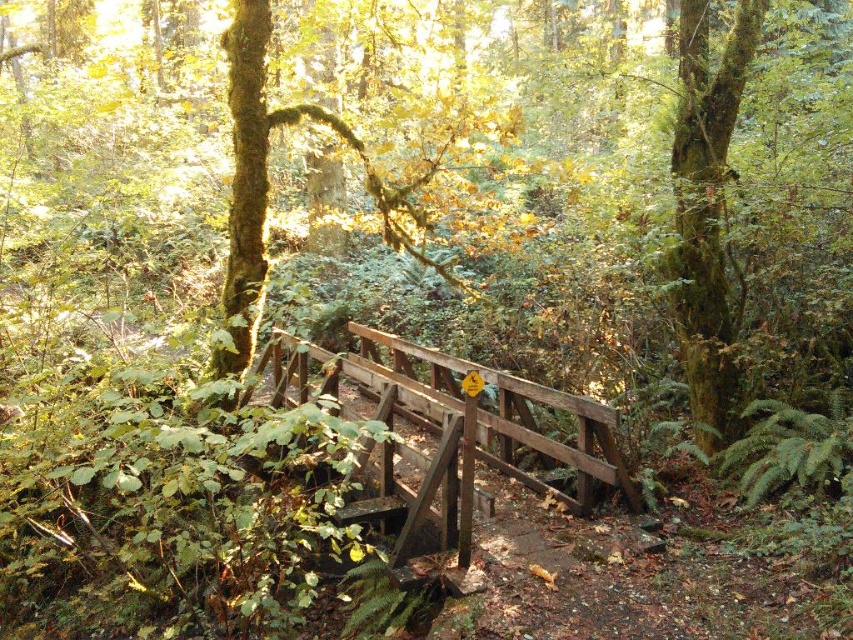
You are standing at the point with coordinates (450, 435) in the forest scene. Based on the image description, what structure are you most likely standing on?

The wooden bridge at center is represented by point (450, 435), so you are most likely standing on the wooden bridge at center.

You are a hiker who wants to cross the stream safely. The wooden bridge at center is your path. However, you notice a green mossy tree at upper left in the background. Is the bridge between you and the tree, blocking your view of it?

Yes, the wooden bridge at center is in front of the green mossy tree at upper left, so the bridge is between you and the tree, blocking your view of it.